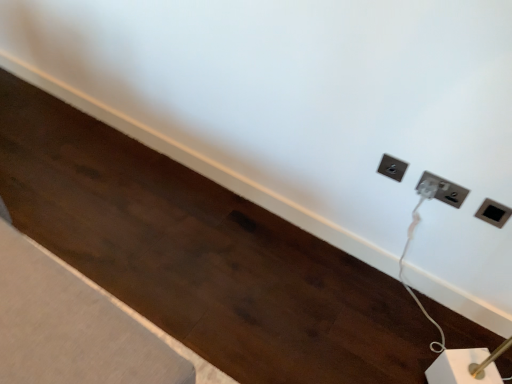
Question: Is white plastic power plug at upper right, placed as the second power plugs and sockets when sorted from right to left, thinner than black plastic power plugs and sockets at upper right, marked as the 3th power plugs and sockets in a right-to-left arrangement?

Choices:
 (A) yes
 (B) no

Answer: (A)

Question: Can you confirm if white plastic power plug at upper right, placed as the second power plugs and sockets when sorted from right to left, is taller than black plastic power plugs and sockets at upper right, arranged as the 1th power plugs and sockets when viewed from the left?

Choices:
 (A) no
 (B) yes

Answer: (A)

Question: Is black plastic power plugs and sockets at upper right, arranged as the 1th power plugs and sockets when viewed from the left, a part of white plastic power plug at upper right, placed as the second power plugs and sockets when sorted from right to left?

Choices:
 (A) yes
 (B) no

Answer: (B)

Question: Does white plastic power plug at upper right, placed as the second power plugs and sockets when sorted from right to left, lie in front of black plastic power plugs and sockets at upper right, marked as the 3th power plugs and sockets in a right-to-left arrangement?

Choices:
 (A) yes
 (B) no

Answer: (A)

Question: Could you tell me if white plastic power plug at upper right, placed as the second power plugs and sockets when sorted from right to left, is turned towards black plastic power plugs and sockets at upper right, marked as the 3th power plugs and sockets in a right-to-left arrangement?

Choices:
 (A) no
 (B) yes

Answer: (A)

Question: Is there a large distance between white plastic power plug at upper right, which is the second power plugs and sockets in left-to-right order, and black plastic power plugs and sockets at upper right, arranged as the 1th power plugs and sockets when viewed from the left?

Choices:
 (A) no
 (B) yes

Answer: (A)

Question: Considering the relative sizes of black plastic power plugs and sockets at upper right, marked as the 3th power plugs and sockets in a right-to-left arrangement, and white plastic power plug at upper right, which is the second power plugs and sockets in left-to-right order, in the image provided, is black plastic power plugs and sockets at upper right, marked as the 3th power plugs and sockets in a right-to-left arrangement, thinner than white plastic power plug at upper right, which is the second power plugs and sockets in left-to-right order,?

Choices:
 (A) no
 (B) yes

Answer: (A)

Question: Considering the relative sizes of black plastic power plugs and sockets at upper right, marked as the 3th power plugs and sockets in a right-to-left arrangement, and white plastic power plug at upper right, which is the second power plugs and sockets in left-to-right order, in the image provided, is black plastic power plugs and sockets at upper right, marked as the 3th power plugs and sockets in a right-to-left arrangement, taller than white plastic power plug at upper right, which is the second power plugs and sockets in left-to-right order,?

Choices:
 (A) yes
 (B) no

Answer: (A)

Question: Are black plastic power plugs and sockets at upper right, arranged as the 1th power plugs and sockets when viewed from the left, and white plastic power plug at upper right, which is the second power plugs and sockets in left-to-right order, located far from each other?

Choices:
 (A) yes
 (B) no

Answer: (B)

Question: Does black plastic power plugs and sockets at upper right, arranged as the 1th power plugs and sockets when viewed from the left, appear on the left side of white plastic power plug at upper right, placed as the second power plugs and sockets when sorted from right to left?

Choices:
 (A) yes
 (B) no

Answer: (A)

Question: Does black plastic power plugs and sockets at upper right, arranged as the 1th power plugs and sockets when viewed from the left, lie behind white plastic power plug at upper right, placed as the second power plugs and sockets when sorted from right to left?

Choices:
 (A) no
 (B) yes

Answer: (B)

Question: Is black plastic power plugs and sockets at upper right, arranged as the 1th power plugs and sockets when viewed from the left, next to white plastic power plug at upper right, placed as the second power plugs and sockets when sorted from right to left, and touching it?

Choices:
 (A) yes
 (B) no

Answer: (B)

Question: From the image's perspective, is black plastic socket at upper right, placed as the third power plugs and sockets when sorted from left to right, under white plastic power plug at upper right, placed as the second power plugs and sockets when sorted from right to left?

Choices:
 (A) no
 (B) yes

Answer: (B)